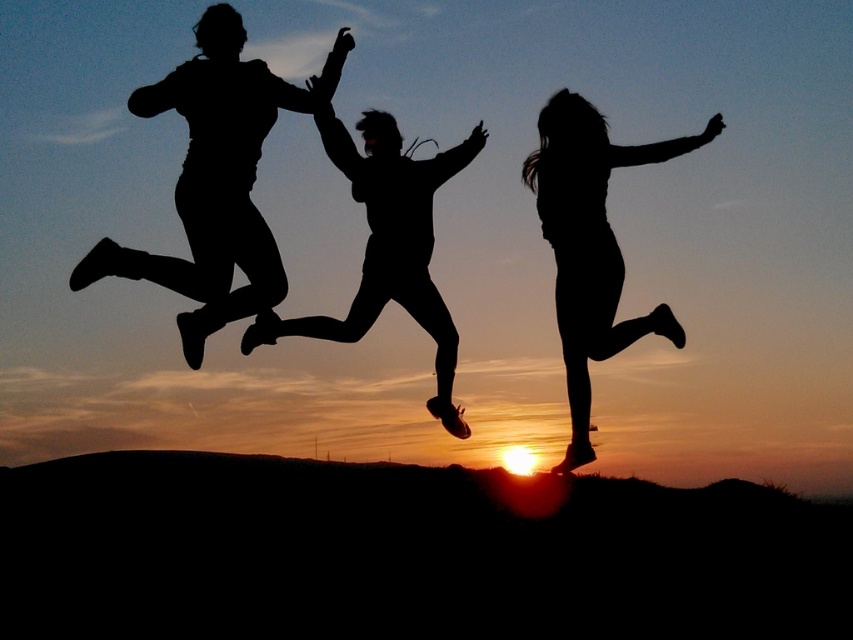
Who is shorter, black matte figure at center or black matte silhouette at center?

black matte silhouette at center

Describe the element at coordinates (590, 244) in the screenshot. The width and height of the screenshot is (853, 640). I see `black matte figure at center` at that location.

You are a GUI agent. You are given a task and a screenshot of the screen. Output one action in this format:
    pyautogui.click(x=<x>, y=<y>)
    Task: Click on the black matte figure at center
    This screenshot has height=640, width=853.
    Given the screenshot: What is the action you would take?
    pyautogui.click(x=590, y=244)